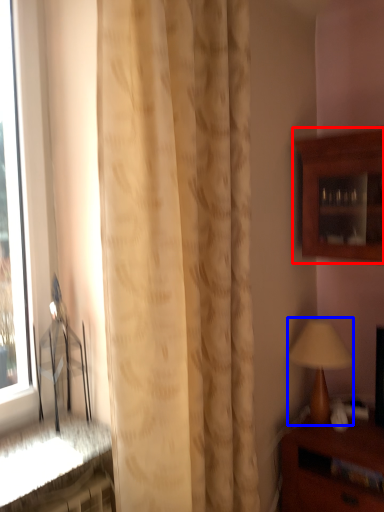
Question: Which of the following is the closest to the observer, cabinetry (highlighted by a red box) or table lamp (highlighted by a blue box)?

Choices:
 (A) cabinetry
 (B) table lamp

Answer: (A)